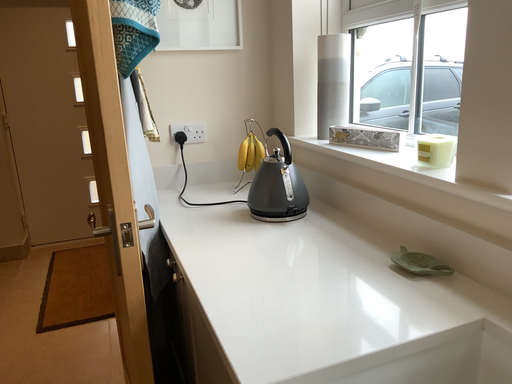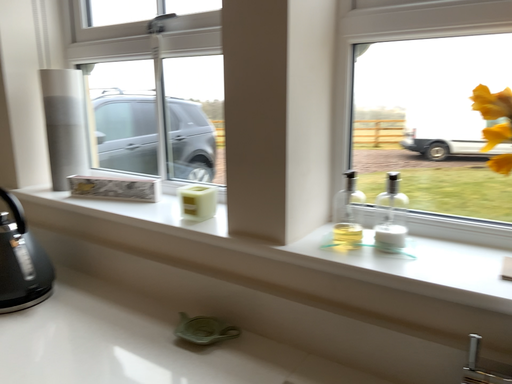
Question: How did the camera likely rotate when shooting the video?

Choices:
 (A) rotated left
 (B) rotated right

Answer: (B)